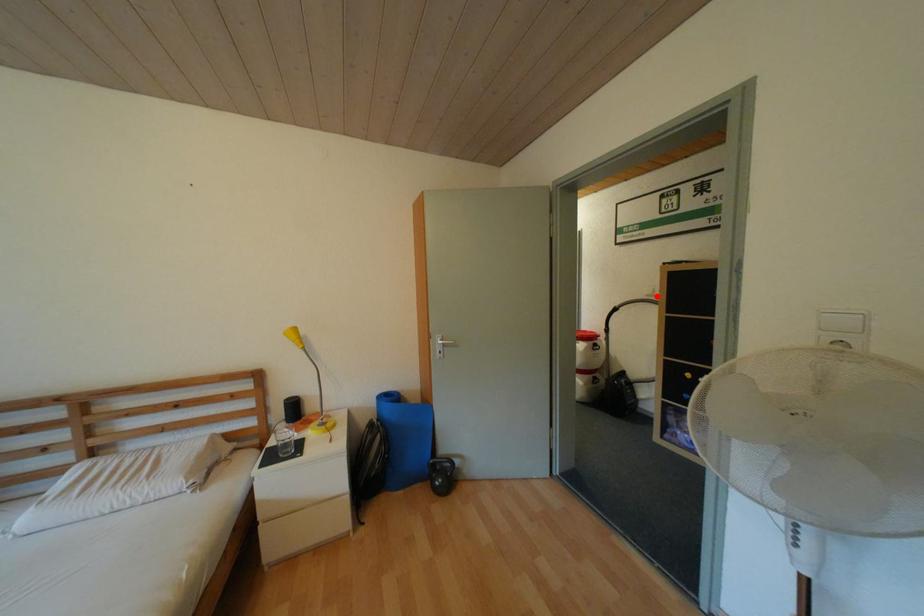
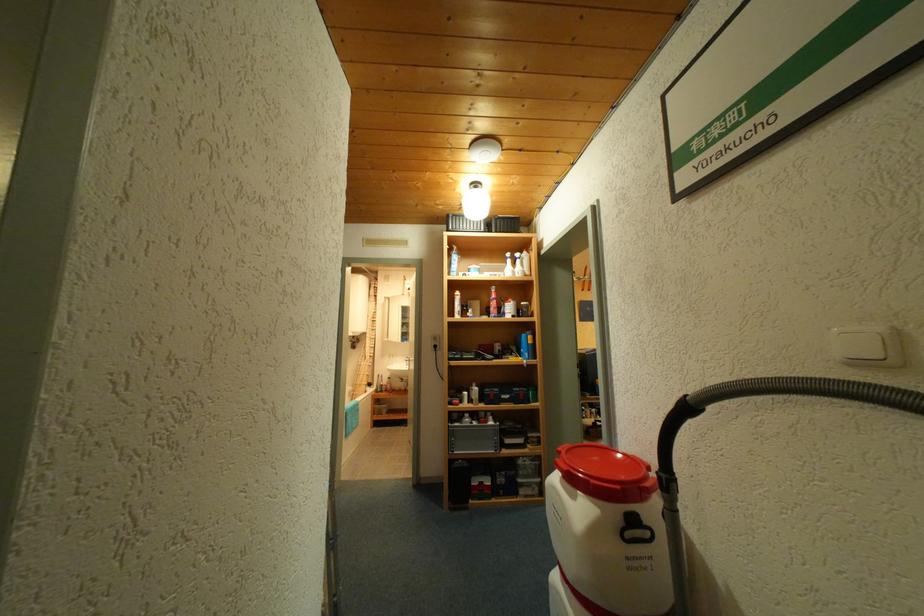
Question: I am providing you with two images of the same scene from different viewpoints. In image1, a red point is highlighted. Considering the same 3D point in image2, which of the following is correct?

Choices:
 (A) It is closer
 (B) It is farther

Answer: (B)